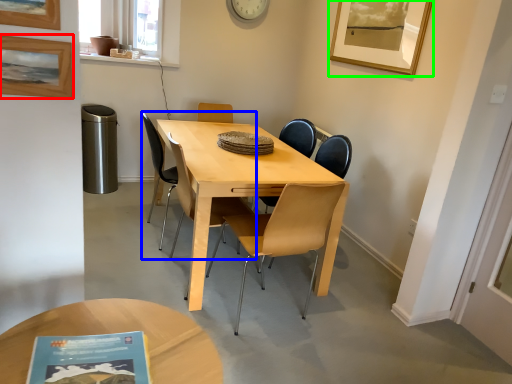
Question: Estimate the real-world distances between objects in this image. Which object is farther from picture frame (highlighted by a red box), chair (highlighted by a blue box) or picture frame (highlighted by a green box)?

Choices:
 (A) chair
 (B) picture frame

Answer: (B)